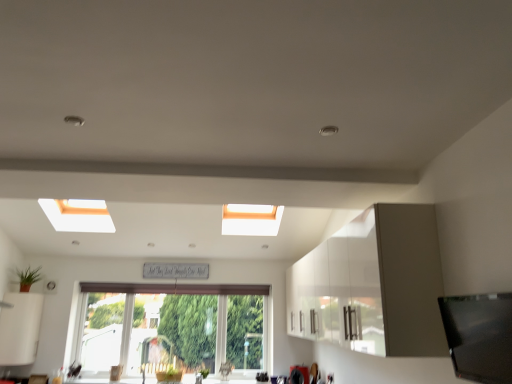
Question: From the image's perspective, would you say clear glass window at center is shown under white matte cabinet at lower left, the 1th cabinetry viewed from the left?

Choices:
 (A) no
 (B) yes

Answer: (B)

Question: Is clear glass window at center located outside white matte cabinet at lower left, the 1th cabinetry viewed from the left?

Choices:
 (A) yes
 (B) no

Answer: (A)

Question: Is clear glass window at center taller than white matte cabinet at lower left, the 1th cabinetry viewed from the left?

Choices:
 (A) no
 (B) yes

Answer: (B)

Question: Is clear glass window at center beside white matte cabinet at lower left, which is counted as the second cabinetry, starting from the right?

Choices:
 (A) no
 (B) yes

Answer: (A)

Question: From a real-world perspective, is clear glass window at center on white matte cabinet at lower left, which is counted as the second cabinetry, starting from the right?

Choices:
 (A) yes
 (B) no

Answer: (B)

Question: Is white matte cabinet at lower left, the 1th cabinetry viewed from the left, wider or thinner than white glossy cabinet at upper right, which is the 1th cabinetry in right-to-left order?

Choices:
 (A) wide
 (B) thin

Answer: (A)

Question: Is point (8, 304) closer or farther from the camera than point (401, 334)?

Choices:
 (A) closer
 (B) farther

Answer: (B)

Question: In the image, is white matte cabinet at lower left, which is counted as the second cabinetry, starting from the right, on the left side or the right side of white glossy cabinet at upper right, which appears as the 2th cabinetry when viewed from the left?

Choices:
 (A) left
 (B) right

Answer: (A)

Question: Considering the positions of white matte cabinet at lower left, which is counted as the second cabinetry, starting from the right, and white glossy cabinet at upper right, which appears as the 2th cabinetry when viewed from the left, in the image, is white matte cabinet at lower left, which is counted as the second cabinetry, starting from the right, taller or shorter than white glossy cabinet at upper right, which appears as the 2th cabinetry when viewed from the left,?

Choices:
 (A) tall
 (B) short

Answer: (B)

Question: Looking at their shapes, would you say clear glass window at center is wider or thinner than white glossy cabinet at upper right, which appears as the 2th cabinetry when viewed from the left?

Choices:
 (A) thin
 (B) wide

Answer: (A)

Question: Considering the positions of clear glass window at center and white glossy cabinet at upper right, which is the 1th cabinetry in right-to-left order, in the image, is clear glass window at center bigger or smaller than white glossy cabinet at upper right, which is the 1th cabinetry in right-to-left order,?

Choices:
 (A) big
 (B) small

Answer: (B)

Question: From a real-world perspective, is clear glass window at center above or below white glossy cabinet at upper right, which appears as the 2th cabinetry when viewed from the left?

Choices:
 (A) above
 (B) below

Answer: (B)

Question: Does point (244, 365) appear closer or farther from the camera than point (367, 342)?

Choices:
 (A) farther
 (B) closer

Answer: (A)

Question: In the image, is white glossy cabinet at upper right, which appears as the 2th cabinetry when viewed from the left, on the left side or the right side of green matte plant at lower left, the 1th plant in the left-to-right sequence?

Choices:
 (A) right
 (B) left

Answer: (A)

Question: Considering the positions of white glossy cabinet at upper right, which is the 1th cabinetry in right-to-left order, and green matte plant at lower left, which is counted as the first plant, starting from the top, in the image, is white glossy cabinet at upper right, which is the 1th cabinetry in right-to-left order, bigger or smaller than green matte plant at lower left, which is counted as the first plant, starting from the top,?

Choices:
 (A) big
 (B) small

Answer: (A)